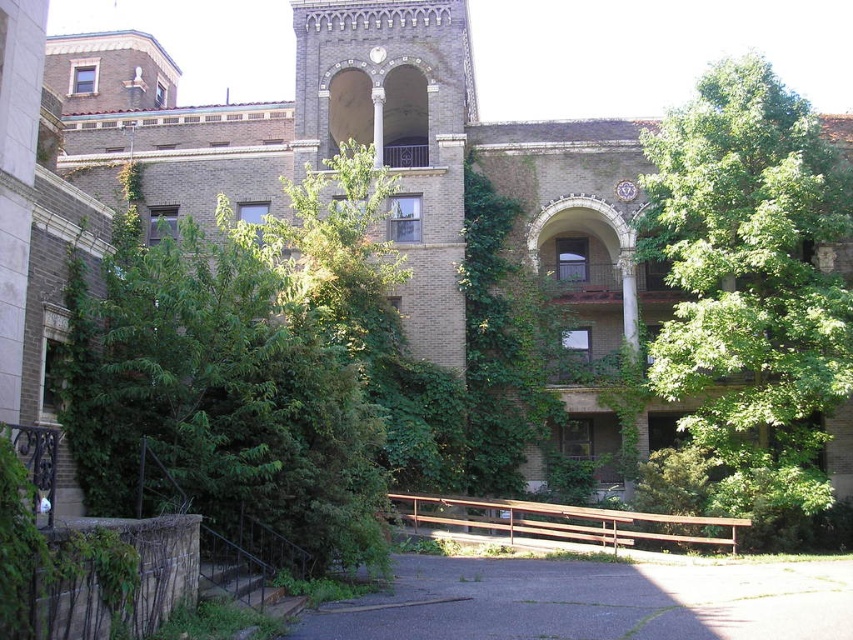
Who is shorter, green leafy tree at center or green leafy tree at upper right?

Standing shorter between the two is green leafy tree at center.

Who is more forward, [300,508] or [682,317]?

Point [300,508] is in front.

Does point (248, 472) come farther from viewer compared to point (688, 378)?

No, it is in front of (688, 378).

At what (x,y) coordinates should I click in order to perform the action: click on green leafy tree at center. Please return your answer as a coordinate pair (x, y). This screenshot has height=640, width=853. Looking at the image, I should click on (219, 401).